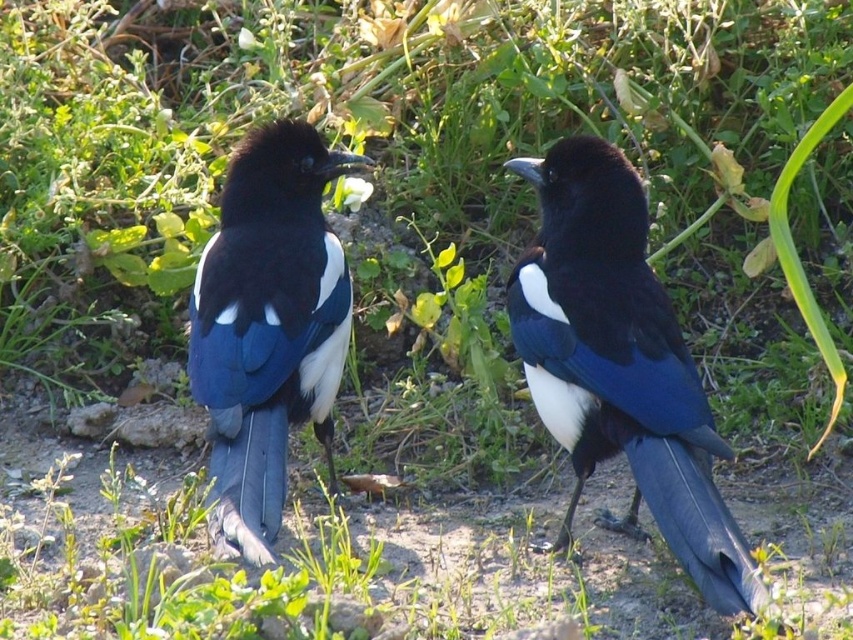
Question: Among these points, which one is nearest to the camera?

Choices:
 (A) (438, 515)
 (B) (648, 288)

Answer: (B)

Question: In this image, where is green leafy grass at center located relative to shiny black magpie at center?

Choices:
 (A) left
 (B) right

Answer: (A)

Question: Which of the following is the farthest from the observer?

Choices:
 (A) (233, 156)
 (B) (682, 486)

Answer: (A)

Question: Which point is closer to the camera?

Choices:
 (A) shiny blue magpie at center
 (B) green leafy grass at center
 (C) shiny black magpie at center

Answer: (B)

Question: Does shiny black magpie at center lie behind shiny blue magpie at center?

Choices:
 (A) no
 (B) yes

Answer: (A)

Question: Does green leafy grass at center have a lesser width compared to shiny black magpie at center?

Choices:
 (A) no
 (B) yes

Answer: (A)